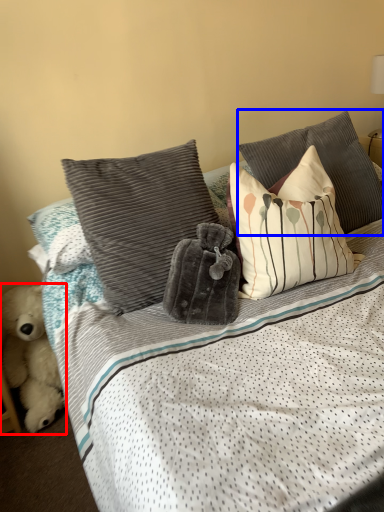
Question: Which object is further to the camera taking this photo, teddy bear (highlighted by a red box) or pillow (highlighted by a blue box)?

Choices:
 (A) teddy bear
 (B) pillow

Answer: (A)